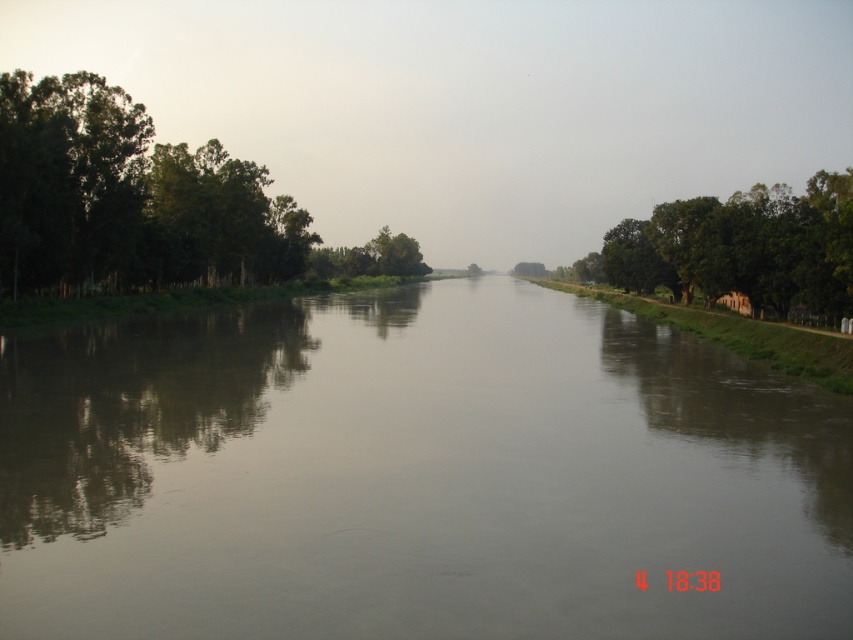
Question: Based on their relative distances, which object is farther from the brown smooth water at center?

Choices:
 (A) green leafy trees at left
 (B) green leafy tree at center
 (C) green leafy trees at right

Answer: (B)

Question: Does brown smooth water at center appear under green leafy trees at left?

Choices:
 (A) yes
 (B) no

Answer: (A)

Question: Which point appears closest to the camera in this image?

Choices:
 (A) (154, 182)
 (B) (581, 275)
 (C) (334, 260)
 (D) (170, 410)

Answer: (D)

Question: Does green leafy trees at left have a lesser width compared to green leafy trees at right?

Choices:
 (A) no
 (B) yes

Answer: (B)

Question: Does brown smooth water at center have a larger size compared to green leafy trees at left?

Choices:
 (A) yes
 (B) no

Answer: (B)

Question: Which of the following is the closest to the observer?

Choices:
 (A) (376, 259)
 (B) (775, 269)

Answer: (B)